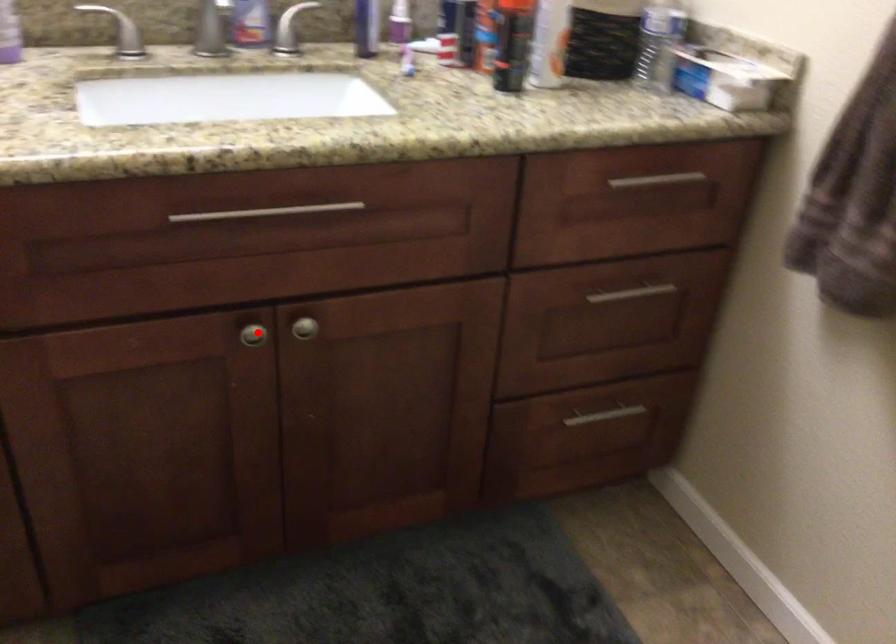
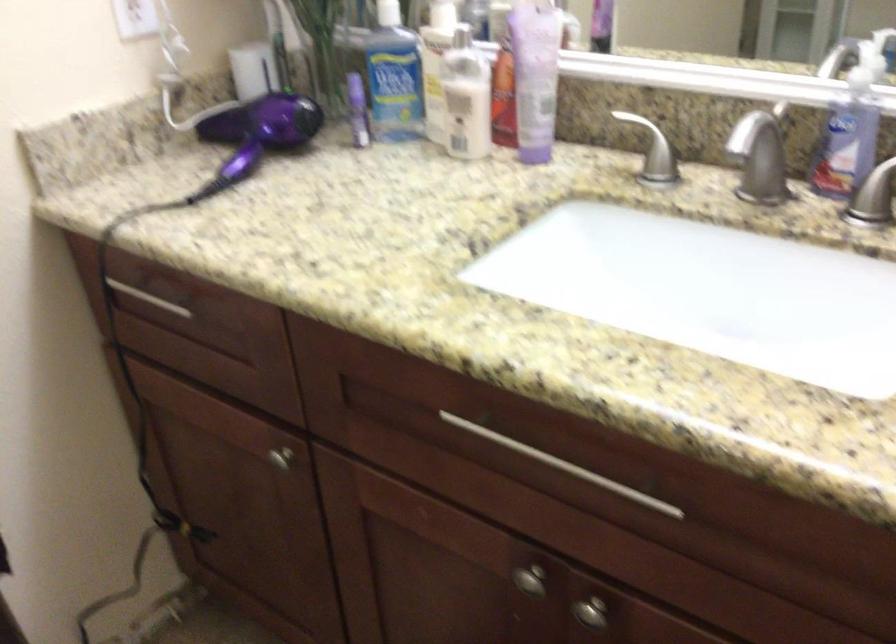
Question: I am providing you with two images of the same scene from different viewpoints. A red point is shown in image1. For the corresponding object point in image2, is it positioned nearer or farther from the camera?

Choices:
 (A) Nearer
 (B) Farther

Answer: (A)